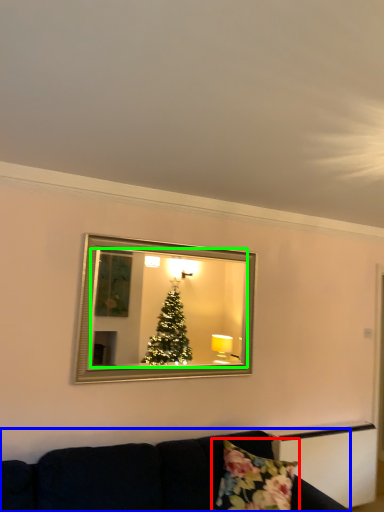
Question: Estimate the real-world distances between objects in this image. Which object is farther from pillow (highlighted by a red box), studio couch (highlighted by a blue box) or mirror (highlighted by a green box)?

Choices:
 (A) studio couch
 (B) mirror

Answer: (B)